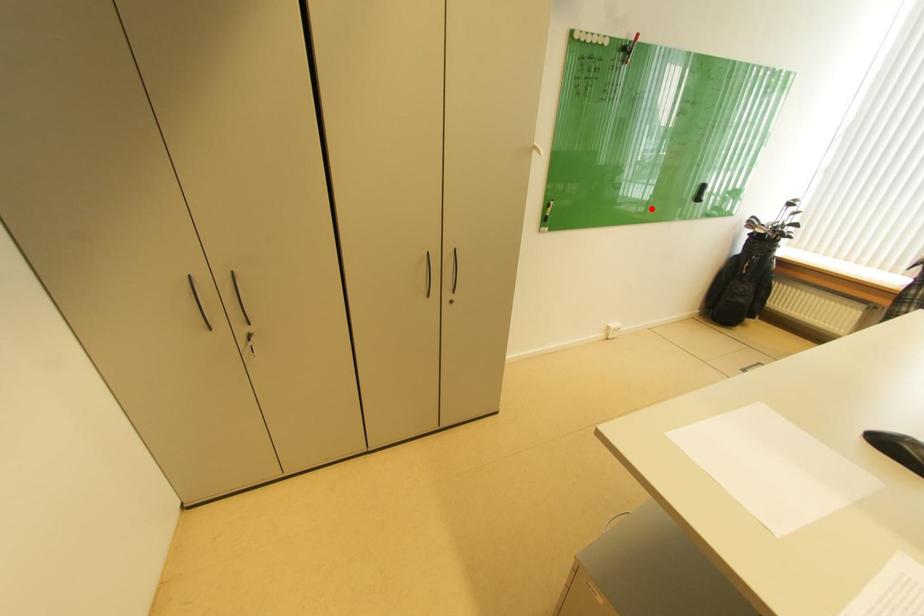
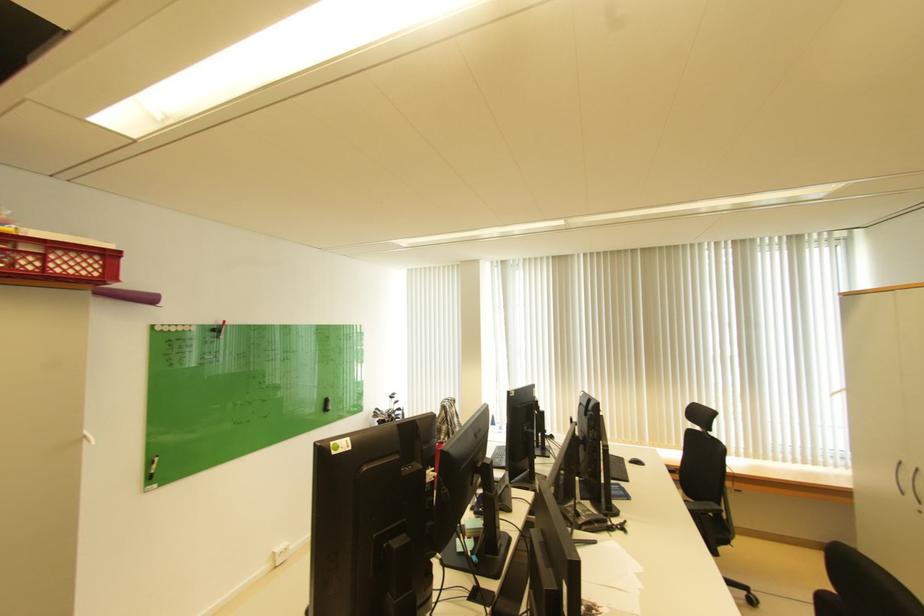
Question: I am providing you with two images of the same scene from different viewpoints. A red point is shown in image1. For the corresponding object point in image2, is it positioned nearer or farther from the camera?

Choices:
 (A) Nearer
 (B) Farther

Answer: (B)